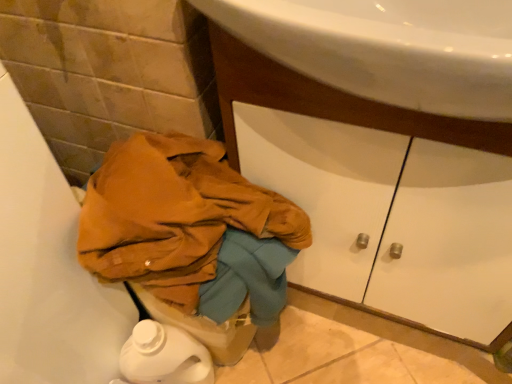
The width and height of the screenshot is (512, 384). What do you see at coordinates (392, 218) in the screenshot?
I see `white matte drawer at center` at bounding box center [392, 218].

The image size is (512, 384). I want to click on white matte drawer at center, so 392,218.

What is the approximate height of white matte drawer at center?

white matte drawer at center is 70.77 centimeters tall.

Describe the element at coordinates (48, 268) in the screenshot. I see `matte orange fabric at lower left` at that location.

Where is `matte orange fabric at lower left`? matte orange fabric at lower left is located at coordinates (48, 268).

Identify the location of white matte drawer at center. The image size is (512, 384). click(392, 218).

In the image, is white matte drawer at center on the left side or the right side of matte orange fabric at lower left?

white matte drawer at center is to the right of matte orange fabric at lower left.

Who is more distant, white matte drawer at center or matte orange fabric at lower left?

white matte drawer at center is further away from the camera.

Which is farther, (393, 224) or (7, 296)?

The point (393, 224) is behind.

From the image's perspective, which is above, white matte drawer at center or matte orange fabric at lower left?

white matte drawer at center, from the image's perspective.

From a real-world perspective, between white matte drawer at center and matte orange fabric at lower left, who is vertically lower?

matte orange fabric at lower left.

Considering the sizes of objects white matte drawer at center and matte orange fabric at lower left in the image provided, who is wider, white matte drawer at center or matte orange fabric at lower left?

Wider between the two is matte orange fabric at lower left.

Between white matte drawer at center and matte orange fabric at lower left, which one has more height?

With more height is matte orange fabric at lower left.

Considering the sizes of objects white matte drawer at center and matte orange fabric at lower left in the image provided, who is smaller, white matte drawer at center or matte orange fabric at lower left?

Smaller between the two is white matte drawer at center.

Is white matte drawer at center surrounding matte orange fabric at lower left?

No, matte orange fabric at lower left is located outside of white matte drawer at center.

Are white matte drawer at center and matte orange fabric at lower left far apart?

No, white matte drawer at center is not far from matte orange fabric at lower left.

Is white matte drawer at center positioned with its back to matte orange fabric at lower left?

white matte drawer at center is not turned away from matte orange fabric at lower left.

Where is `bath beneath the white matte drawer at center (from a real-world perspective)`? bath beneath the white matte drawer at center (from a real-world perspective) is located at coordinates (48, 268).

Considering the relative positions of matte orange fabric at lower left and white matte drawer at center in the image provided, is matte orange fabric at lower left to the left or to the right of white matte drawer at center?

Based on their positions, matte orange fabric at lower left is located to the left of white matte drawer at center.

In the scene shown: Is the depth of matte orange fabric at lower left greater than that of white matte drawer at center?

No, the depth of matte orange fabric at lower left is less than that of white matte drawer at center.

Is point (31, 362) behind point (343, 130)?

No, it is in front of (343, 130).

From the image's perspective, is matte orange fabric at lower left on white matte drawer at center?

No, from the image's perspective, matte orange fabric at lower left is not over white matte drawer at center.

From a real-world perspective, is matte orange fabric at lower left positioned under white matte drawer at center based on gravity?

Yes, from a real-world perspective, matte orange fabric at lower left is under white matte drawer at center.

Between matte orange fabric at lower left and white matte drawer at center, which one has smaller width?

Thinner between the two is white matte drawer at center.

Is matte orange fabric at lower left taller or shorter than white matte drawer at center?

In the image, matte orange fabric at lower left appears to be taller than white matte drawer at center.

In terms of size, does matte orange fabric at lower left appear bigger or smaller than white matte drawer at center?

Considering their sizes, matte orange fabric at lower left takes up more space than white matte drawer at center.

Would you say matte orange fabric at lower left is inside or outside white matte drawer at center?

matte orange fabric at lower left is not enclosed by white matte drawer at center.

Would you consider matte orange fabric at lower left to be distant from white matte drawer at center?

No.

Is matte orange fabric at lower left looking in the opposite direction of white matte drawer at center?

matte orange fabric at lower left is not turned away from white matte drawer at center.

At what (x,y) coordinates should I click in order to perform the action: click on bath in front of the white matte drawer at center. Please return your answer as a coordinate pair (x, y). Looking at the image, I should click on (48, 268).

Where is `drawer to the right of matte orange fabric at lower left`? drawer to the right of matte orange fabric at lower left is located at coordinates click(392, 218).

There is a matte orange fabric at lower left. At what (x,y) coordinates should I click in order to perform the action: click on drawer above it (from a real-world perspective). Please return your answer as a coordinate pair (x, y). This screenshot has height=384, width=512. Looking at the image, I should click on (392, 218).